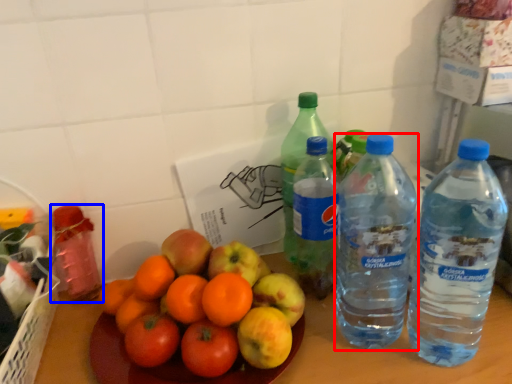
Question: Which point is closer to the camera, bottle (highlighted by a red box) or bottle (highlighted by a blue box)?

Choices:
 (A) bottle
 (B) bottle

Answer: (A)